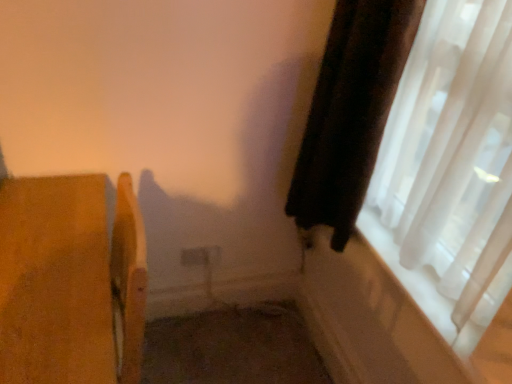
The width and height of the screenshot is (512, 384). What do you see at coordinates (450, 169) in the screenshot? I see `translucent white curtain at right` at bounding box center [450, 169].

What do you see at coordinates (350, 112) in the screenshot?
I see `velvet dark brown curtain at right` at bounding box center [350, 112].

The width and height of the screenshot is (512, 384). What are the coordinates of `translucent white curtain at right` in the screenshot? It's located at (450, 169).

Is velvet dark brown curtain at right located outside translucent white curtain at right?

No, most part of velvet dark brown curtain at right lies within translucent white curtain at right.

Is point (333, 67) positioned before point (461, 303)?

No, it is behind (461, 303).

From a real-world perspective, is velvet dark brown curtain at right over translucent white curtain at right?

No, from a real-world perspective, velvet dark brown curtain at right is not above translucent white curtain at right.

Considering the sizes of objects velvet dark brown curtain at right and translucent white curtain at right in the image provided, who is thinner, velvet dark brown curtain at right or translucent white curtain at right?

With smaller width is translucent white curtain at right.

Based on the photo, from a real-world perspective, is velvet dark brown curtain at right below wooden chair at left?

No, from a real-world perspective, velvet dark brown curtain at right is not beneath wooden chair at left.

From the image's perspective, is velvet dark brown curtain at right below wooden chair at left?

No, from the image's perspective, velvet dark brown curtain at right is not below wooden chair at left.

Considering the relative positions of velvet dark brown curtain at right and wooden chair at left in the image provided, is velvet dark brown curtain at right to the left of wooden chair at left from the viewer's perspective?

Incorrect, velvet dark brown curtain at right is not on the left side of wooden chair at left.

Is velvet dark brown curtain at right next to wooden chair at left and touching it?

No, velvet dark brown curtain at right is not touching wooden chair at left.

Would you say wooden chair at left is outside velvet dark brown curtain at right?

wooden chair at left lies outside velvet dark brown curtain at right's area.

Is wooden chair at left next to velvet dark brown curtain at right and touching it?

wooden chair at left is not next to velvet dark brown curtain at right, and they're not touching.

In terms of height, does wooden chair at left look taller or shorter compared to velvet dark brown curtain at right?

Clearly, wooden chair at left is taller compared to velvet dark brown curtain at right.

From the picture: Does wooden chair at left turn towards velvet dark brown curtain at right?

No.

Considering the relative positions of wooden chair at left and translucent white curtain at right in the image provided, is wooden chair at left to the left or to the right of translucent white curtain at right?

From the image, it's evident that wooden chair at left is to the left of translucent white curtain at right.

Is wooden chair at left oriented away from translucent white curtain at right?

Yes.

Is wooden chair at left shorter than translucent white curtain at right?

In fact, wooden chair at left may be taller than translucent white curtain at right.

Can you confirm if wooden chair at left is bigger than translucent white curtain at right?

Yes, wooden chair at left is bigger than translucent white curtain at right.

From their relative heights in the image, would you say translucent white curtain at right is taller or shorter than wooden chair at left?

translucent white curtain at right is shorter than wooden chair at left.

Can wooden chair at left be found inside translucent white curtain at right?

No, wooden chair at left is located outside of translucent white curtain at right.

Based on the photo, how many degrees apart are the facing directions of translucent white curtain at right and wooden chair at left?

The angle between the facing direction of translucent white curtain at right and the facing direction of wooden chair at left is 0.539 degrees.

Which of these two, translucent white curtain at right or wooden chair at left, is smaller?

translucent white curtain at right.

Between translucent white curtain at right and velvet dark brown curtain at right, which one has larger width?

Wider between the two is velvet dark brown curtain at right.

Is translucent white curtain at right smaller than velvet dark brown curtain at right?

No, translucent white curtain at right is not smaller than velvet dark brown curtain at right.

Which is more to the right, translucent white curtain at right or velvet dark brown curtain at right?

translucent white curtain at right is more to the right.

Would you consider translucent white curtain at right to be distant from velvet dark brown curtain at right?

No, translucent white curtain at right is in close proximity to velvet dark brown curtain at right.

What are the coordinates of `curtain that is under the translucent white curtain at right (from a real-world perspective)` in the screenshot? It's located at (350, 112).

You are a GUI agent. You are given a task and a screenshot of the screen. Output one action in this format:
    pyautogui.click(x=<x>, y=<y>)
    Task: Click on the curtain lying above the wooden chair at left (from the image's perspective)
    
    Given the screenshot: What is the action you would take?
    pyautogui.click(x=350, y=112)

Estimate the real-world distances between objects in this image. Which object is further from velvet dark brown curtain at right, translucent white curtain at right or wooden chair at left?

The object further to velvet dark brown curtain at right is wooden chair at left.

Considering their positions, is velvet dark brown curtain at right positioned closer to translucent white curtain at right than wooden chair at left?

velvet dark brown curtain at right is closer to translucent white curtain at right.

Looking at the image, which one is located further to velvet dark brown curtain at right, wooden chair at left or translucent white curtain at right?

wooden chair at left is further to velvet dark brown curtain at right.

Considering their positions, is wooden chair at left positioned closer to translucent white curtain at right than velvet dark brown curtain at right?

velvet dark brown curtain at right.

Which object lies nearer to the anchor point wooden chair at left, translucent white curtain at right or velvet dark brown curtain at right?

velvet dark brown curtain at right lies closer to wooden chair at left than the other object.

Looking at the image, which one is located further to wooden chair at left, velvet dark brown curtain at right or translucent white curtain at right?

Among the two, translucent white curtain at right is located further to wooden chair at left.

Where is `curtain between wooden chair at left and translucent white curtain at right`? Image resolution: width=512 pixels, height=384 pixels. curtain between wooden chair at left and translucent white curtain at right is located at coordinates coord(350,112).